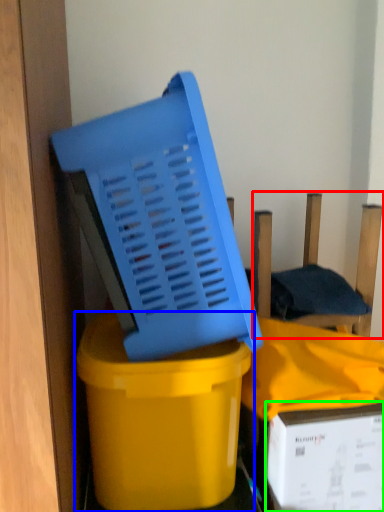
Question: Estimate the real-world distances between objects in this image. Which object is closer to chair (highlighted by a red box), waste container (highlighted by a blue box) or box (highlighted by a green box)?

Choices:
 (A) waste container
 (B) box

Answer: (B)